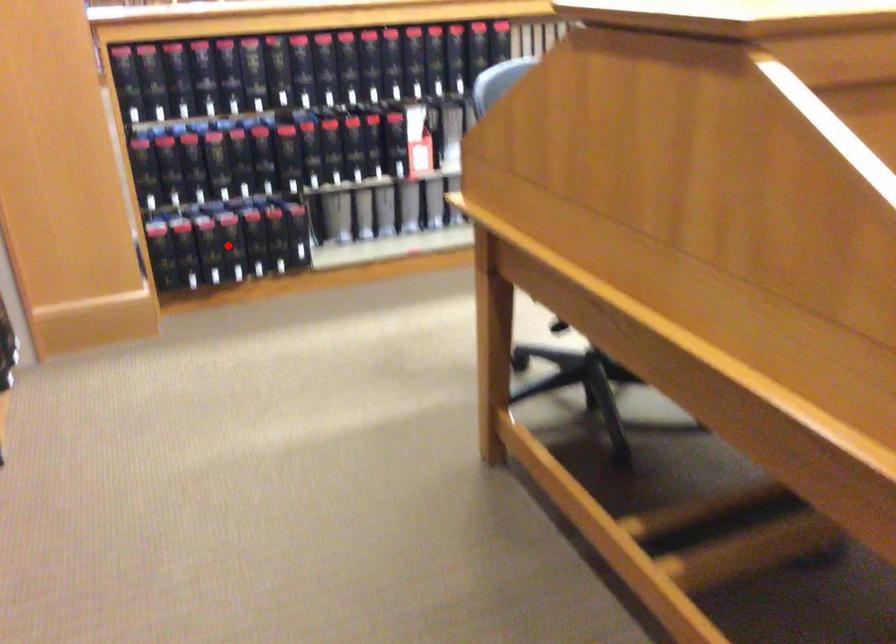
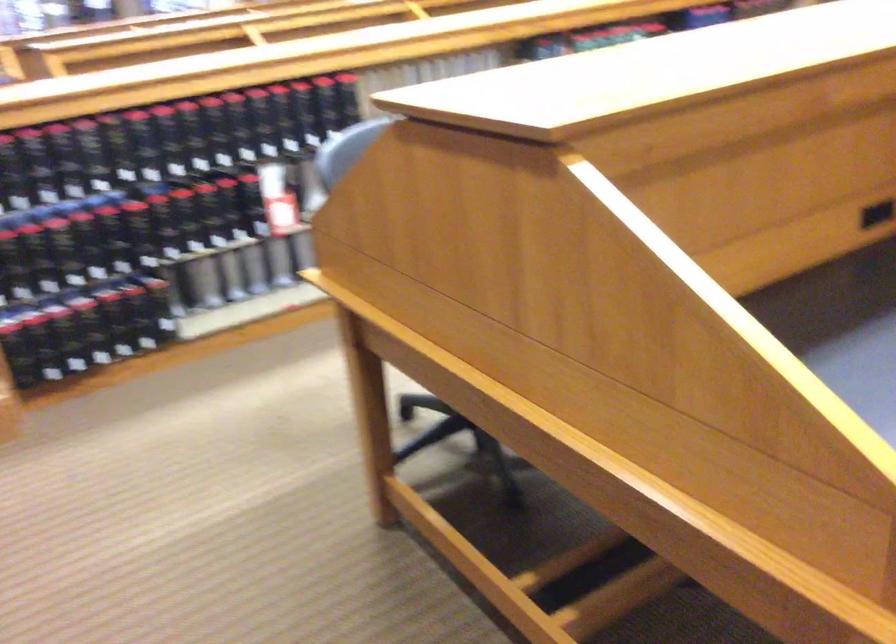
Find the pixel in the second image that matches the highlighted location in the first image.

(87, 328)